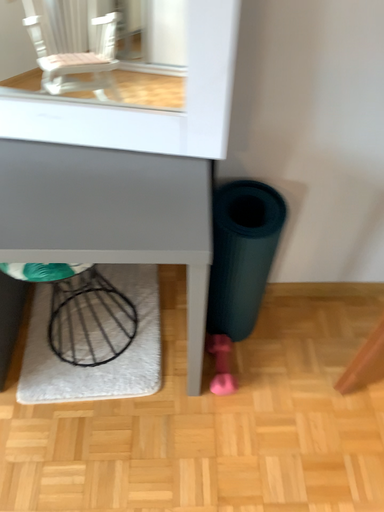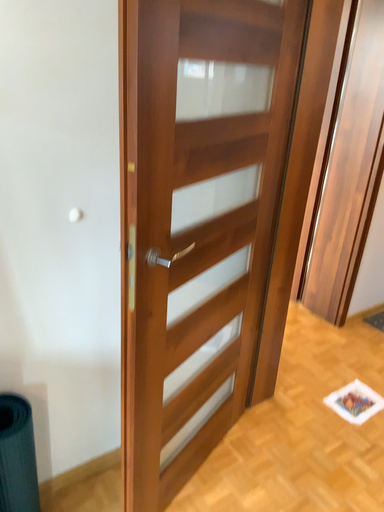
Question: Which way did the camera rotate in the video?

Choices:
 (A) rotated right
 (B) rotated left

Answer: (A)